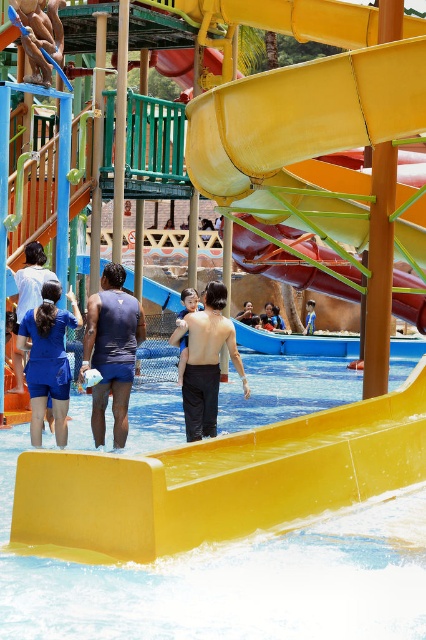
Question: Is matte blue shorts at center closer to the viewer compared to blue fabric dress at left?

Choices:
 (A) yes
 (B) no

Answer: (A)

Question: Observing the image, what is the correct spatial positioning of shiny black shorts at center in reference to blue fabric shorts at lower left?

Choices:
 (A) right
 (B) left

Answer: (A)

Question: Which object appears farthest from the camera in this image?

Choices:
 (A) matte blue shorts at center
 (B) blue fabric shorts at lower left
 (C) blue fabric shorts at center
 (D) yellow plastic pool at center

Answer: (C)

Question: Which is nearer to the yellow plastic pool at center?

Choices:
 (A) matte blue shorts at center
 (B) blue fabric shorts at center
 (C) blue fabric shorts at lower left
 (D) shiny black shorts at center

Answer: (A)

Question: Which point is closer to the camera?

Choices:
 (A) (221, 324)
 (B) (57, 442)
 (C) (20, 269)

Answer: (A)

Question: Considering the relative positions of matte blue shorts at center and blue fabric shorts at lower left in the image provided, where is matte blue shorts at center located with respect to blue fabric shorts at lower left?

Choices:
 (A) below
 (B) above

Answer: (B)